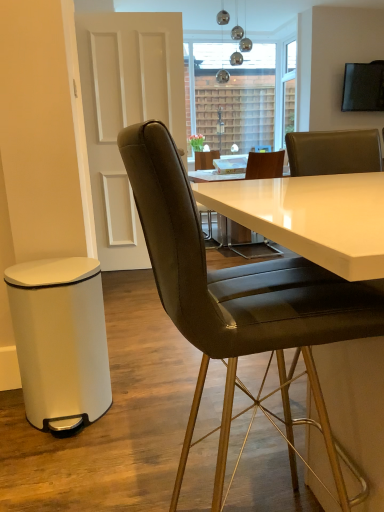
You are a GUI agent. You are given a task and a screenshot of the screen. Output one action in this format:
    pyautogui.click(x=<x>, y=<y>)
    Task: Click on the free spot in front of white matte bar stool at lower left
    The width and height of the screenshot is (384, 512).
    Given the screenshot: What is the action you would take?
    pyautogui.click(x=71, y=466)